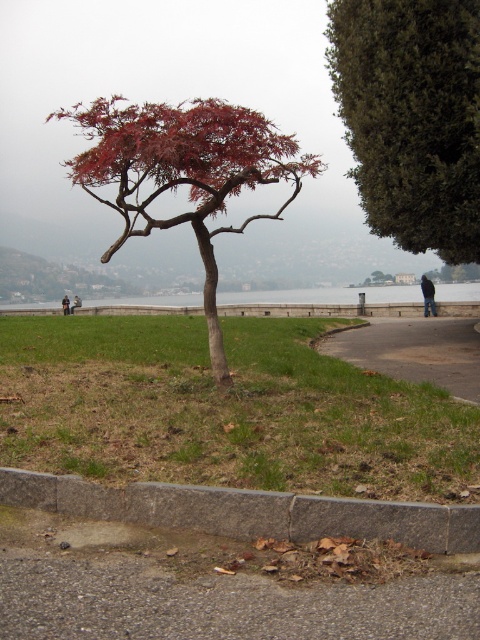
Can you confirm if green grass at lower center is smaller than green fuzzy bush at upper right?

Yes, green grass at lower center is smaller than green fuzzy bush at upper right.

Find the location of a particular element. This screenshot has height=640, width=480. green grass at lower center is located at coordinates (225, 410).

The height and width of the screenshot is (640, 480). Describe the element at coordinates (225, 410) in the screenshot. I see `green grass at lower center` at that location.

Locate an element on the screen. The image size is (480, 640). green grass at lower center is located at coordinates (225, 410).

Does green fuzzy bush at upper right have a lesser width compared to gray concrete curb at lower center?

No.

Which of these two, green fuzzy bush at upper right or gray concrete curb at lower center, stands shorter?

With less height is gray concrete curb at lower center.

Between point (447, 22) and point (16, 497), which one is positioned in front?

Positioned in front is point (16, 497).

Find the location of a particular element. The width and height of the screenshot is (480, 640). green fuzzy bush at upper right is located at coordinates (411, 116).

Is green fuzzy bush at upper right thinner than dark blue jacket at lower right?

No.

Is point (454, 6) positioned in front of point (433, 296)?

Yes, point (454, 6) is in front of point (433, 296).

Between point (355, 145) and point (434, 307), which one is positioned in front?

Point (355, 145) is more forward.

Identify the location of green fuzzy bush at upper right. This screenshot has width=480, height=640. (411, 116).